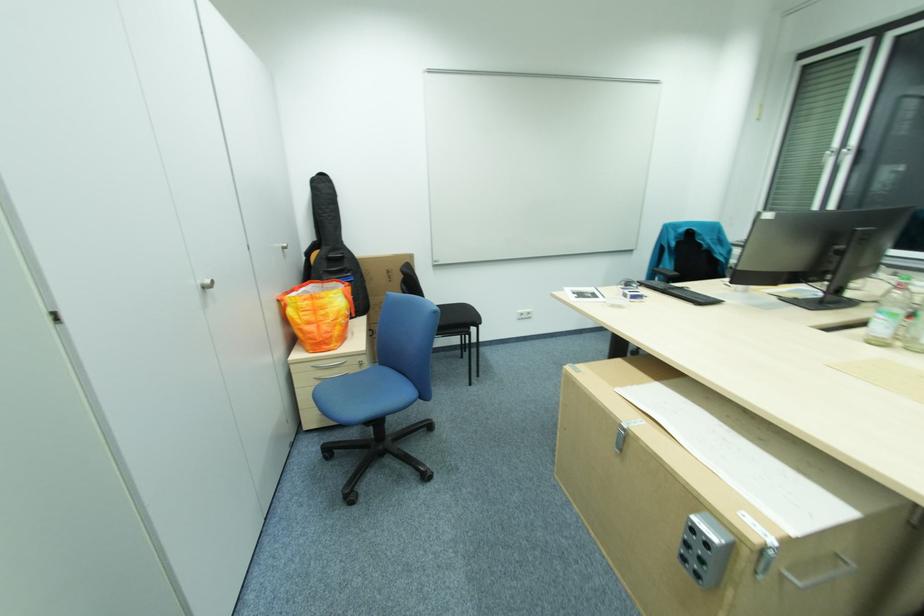
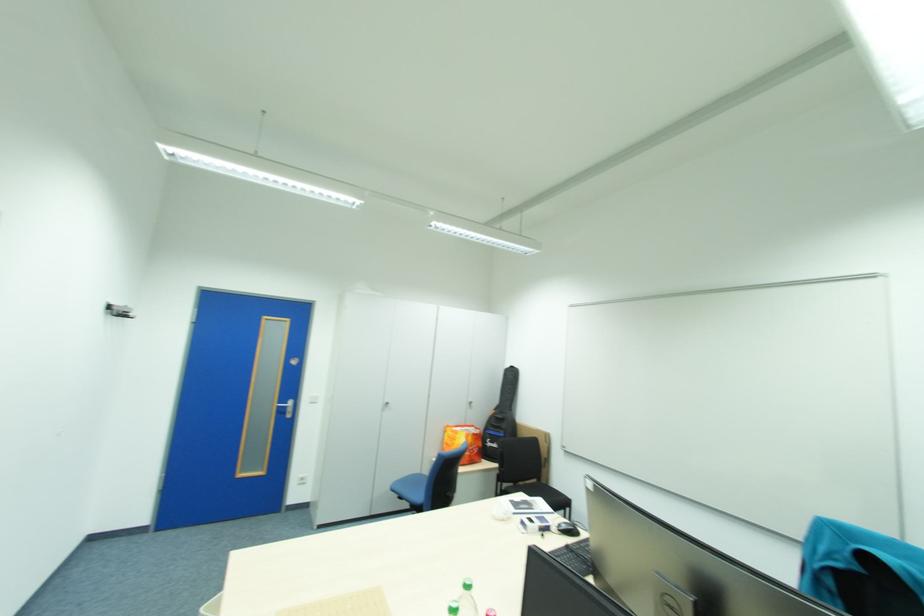
Find the pixel in the second image that matches point (213, 305) in the first image.

(392, 410)